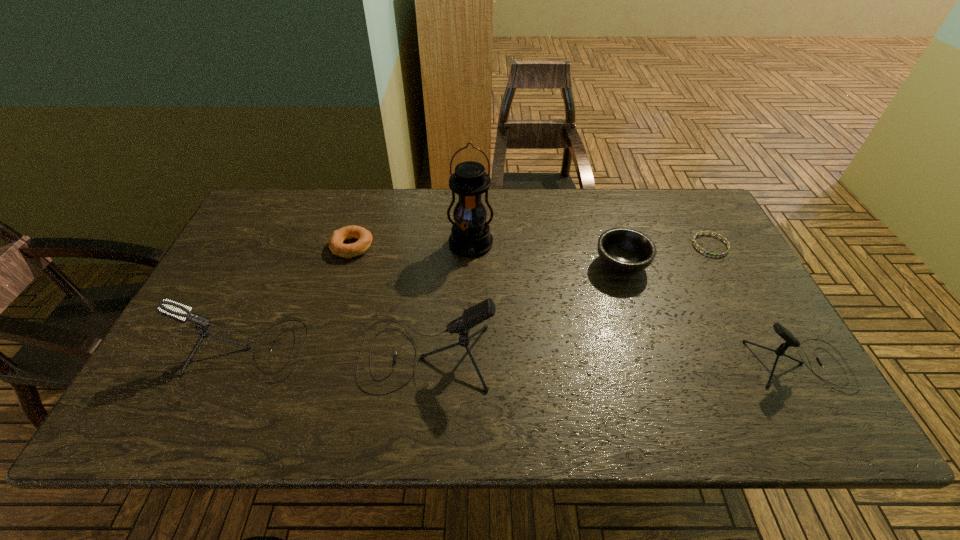
At what (x,y) coordinates should I click in order to perform the action: click on bracelet that is at the far edge. Please return your answer as a coordinate pair (x, y). Looking at the image, I should click on (707, 253).

You are a GUI agent. You are given a task and a screenshot of the screen. Output one action in this format:
    pyautogui.click(x=<x>, y=<y>)
    Task: Click on the object present at the left edge
    Image resolution: width=960 pixels, height=540 pixels.
    Given the screenshot: What is the action you would take?
    pyautogui.click(x=172, y=309)

The image size is (960, 540). Find the location of `microphone present at the right edge`. microphone present at the right edge is located at coordinates (791, 341).

The image size is (960, 540). What are the coordinates of `bracelet at the right edge` in the screenshot? It's located at (707, 253).

The width and height of the screenshot is (960, 540). I want to click on object located at the near left corner, so coord(172,309).

Where is `object that is positioned at the far right corner`? This screenshot has height=540, width=960. object that is positioned at the far right corner is located at coordinates (707, 253).

This screenshot has width=960, height=540. Identify the location of object at the near right corner. (791, 341).

Locate an element on the screen. Image resolution: width=960 pixels, height=540 pixels. free space at the far edge of the desktop is located at coordinates (353, 198).

The height and width of the screenshot is (540, 960). What are the coordinates of `vacant position at the near edge of the desktop` in the screenshot? It's located at (543, 383).

The image size is (960, 540). I want to click on vacant region at the left edge of the desktop, so click(x=221, y=344).